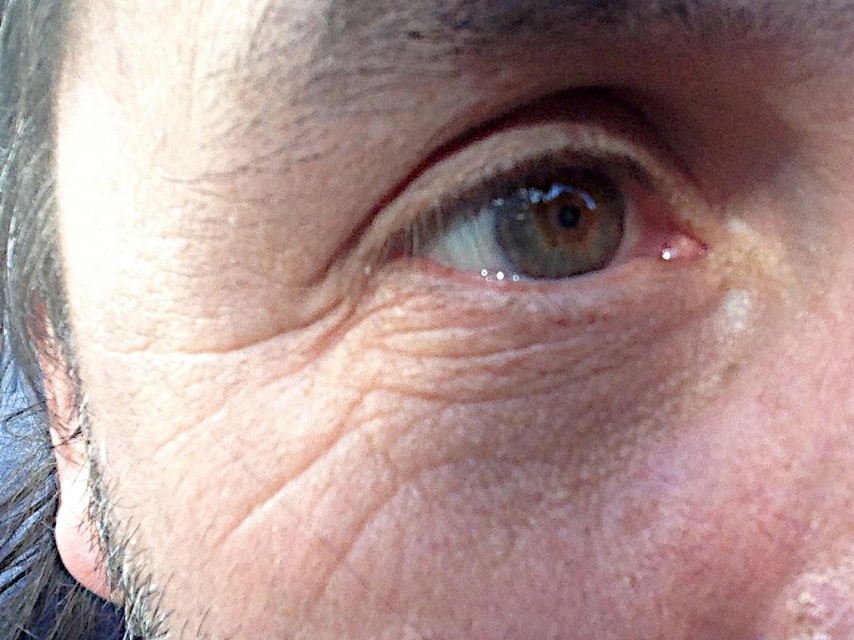
Question: Does green matte eye at center come behind transparent skin at upper center?

Choices:
 (A) no
 (B) yes

Answer: (A)

Question: Can you confirm if green matte eye at center is positioned below transparent skin at upper center?

Choices:
 (A) no
 (B) yes

Answer: (A)

Question: Among these objects, which one is farthest from the camera?

Choices:
 (A) transparent skin at upper center
 (B) green matte eye at center

Answer: (A)

Question: Which point is closer to the camera?

Choices:
 (A) transparent skin at upper center
 (B) green matte eye at center

Answer: (B)

Question: Which object appears closest to the camera in this image?

Choices:
 (A) transparent skin at upper center
 (B) green matte eye at center

Answer: (B)

Question: Does green matte eye at center appear on the right side of transparent skin at upper center?

Choices:
 (A) no
 (B) yes

Answer: (A)